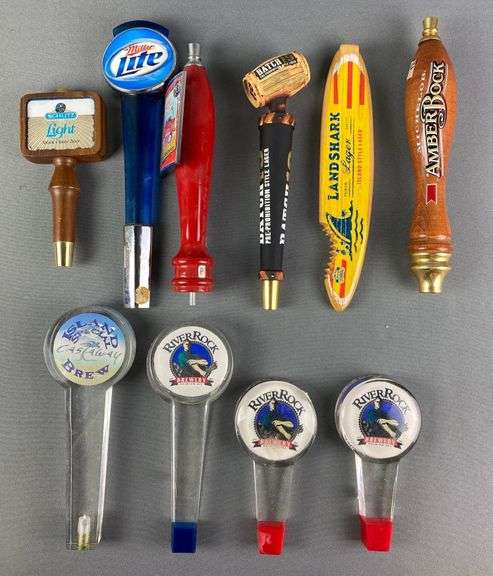
Locate an element on the screen. The width and height of the screenshot is (493, 576). base of beer tap handles is located at coordinates (87, 539), (180, 539), (278, 537), (383, 533), (429, 283), (334, 304), (269, 304), (188, 288), (141, 301), (69, 261).